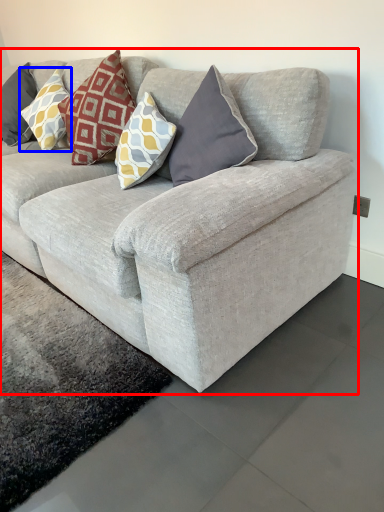
Question: Which point is closer to the camera, studio couch (highlighted by a red box) or pillow (highlighted by a blue box)?

Choices:
 (A) studio couch
 (B) pillow

Answer: (A)